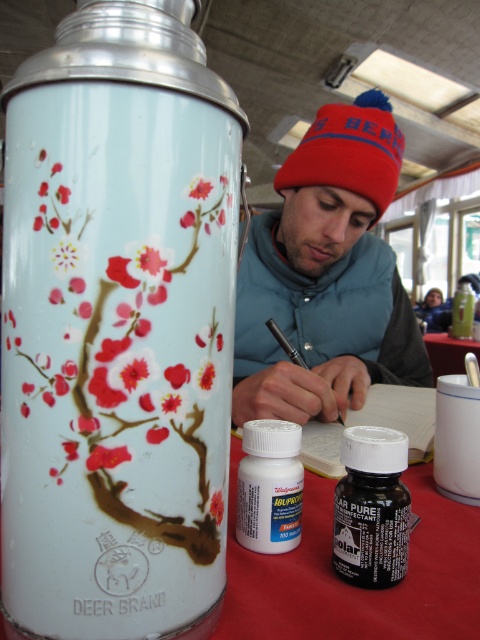
Looking at this image, does white plastic bottle at center appear over translucent plastic bottle at center?

Incorrect, white plastic bottle at center is not positioned above translucent plastic bottle at center.

Can you confirm if white plastic bottle at center is taller than translucent plastic bottle at center?

No.

Is point (254, 433) less distant than point (465, 276)?

Yes, it is in front of point (465, 276).

At what (x,y) coordinates should I click in order to perform the action: click on white plastic bottle at center. Please return your answer as a coordinate pair (x, y). Image resolution: width=480 pixels, height=640 pixels. Looking at the image, I should click on (269, 486).

Does matte blue beanie at center have a larger size compared to translucent plastic bottle at center?

Yes.

Is point (363, 346) farther from camera compared to point (462, 330)?

No, (363, 346) is in front of (462, 330).

Who is more distant from viewer, (x=302, y=413) or (x=467, y=328)?

Point (x=467, y=328)

Where is `matte blue beanie at center`? The image size is (480, 640). matte blue beanie at center is located at coordinates (326, 275).

Can you confirm if matte blue beanie at center is shorter than white plastic bottle at center?

No.

Is matte blue beanie at center above white plastic bottle at center?

Indeed, matte blue beanie at center is positioned over white plastic bottle at center.

Which is behind, point (297, 412) or point (266, 538)?

Point (297, 412)

Image resolution: width=480 pixels, height=640 pixels. I want to click on matte blue beanie at center, so (x=326, y=275).